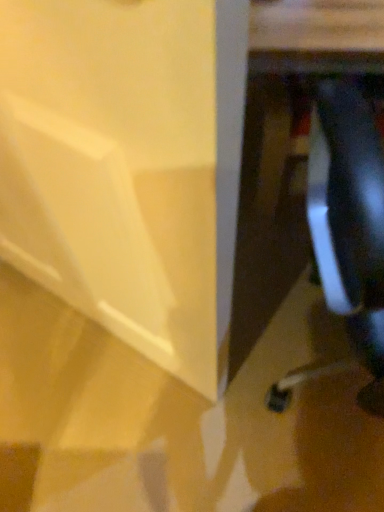
You are a GUI agent. You are given a task and a screenshot of the screen. Output one action in this format:
    pyautogui.click(x=<x>, y=<y>)
    Task: Click on the vacant area situated to the left side of black leather chair at lower right
    
    Given the screenshot: What is the action you would take?
    pyautogui.click(x=183, y=416)